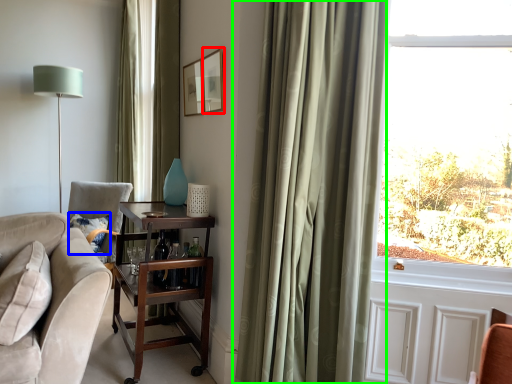
Question: Which object is the farthest from picture frame (highlighted by a red box)? Choose among these: pillow (highlighted by a blue box) or curtain (highlighted by a green box).

Choices:
 (A) pillow
 (B) curtain

Answer: (A)